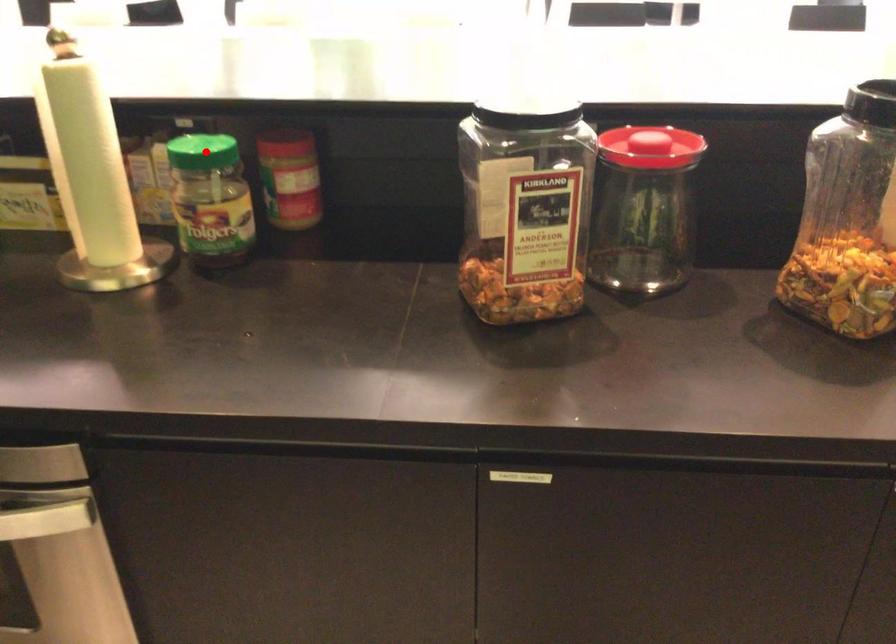
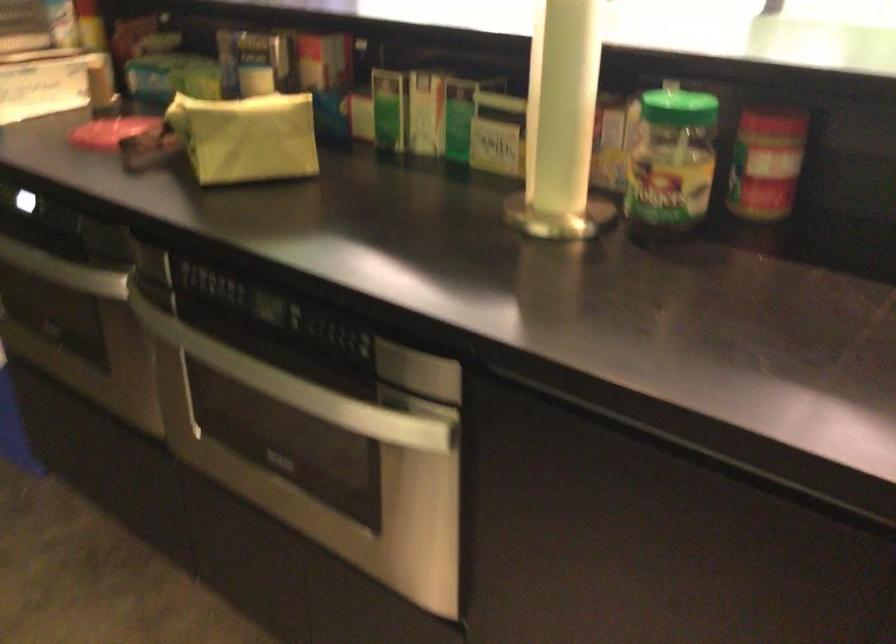
Where in the second image is the point corresponding to the highlighted location from the first image?

(678, 108)